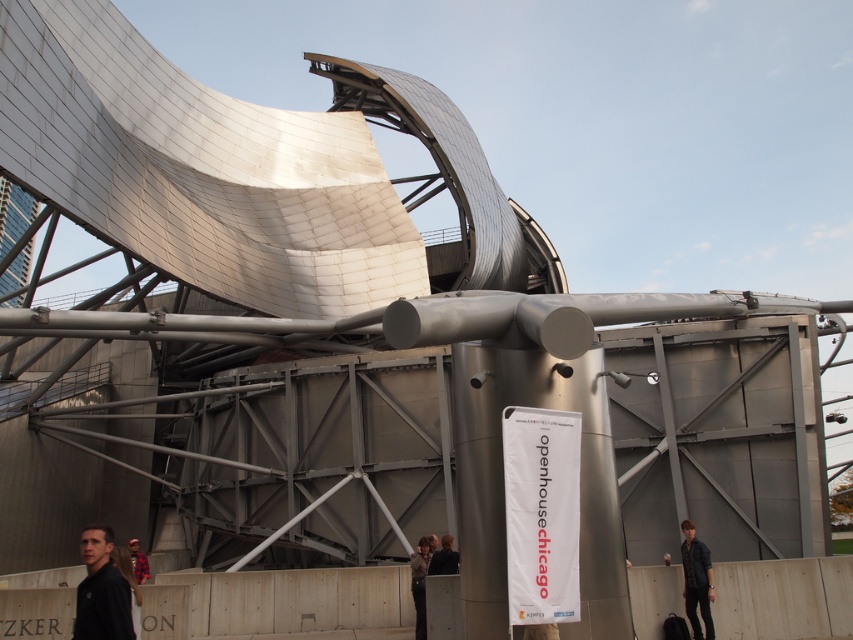
You are standing in front of the modern architectural structure and see a denim jacket at lower right and a dark gray fabric jacket at lower center. Which jacket is taller?

The denim jacket at lower right is much taller than the dark gray fabric jacket at lower center.

You are standing at the center of the image and want to reach the dark gray hoodie at lower left. Which direction should you move in to get there?

To reach the dark gray hoodie at lower left, you should move towards the lower left direction from your current position at the center of the image.

You are standing in front of the modern architectural structure and see two people wearing a dark gray hoodie at lower left and a red plaid shirt at lower left. Which person is positioned more to the right side?

The dark gray hoodie at lower left is positioned more to the right side than the red plaid shirt at lower left.